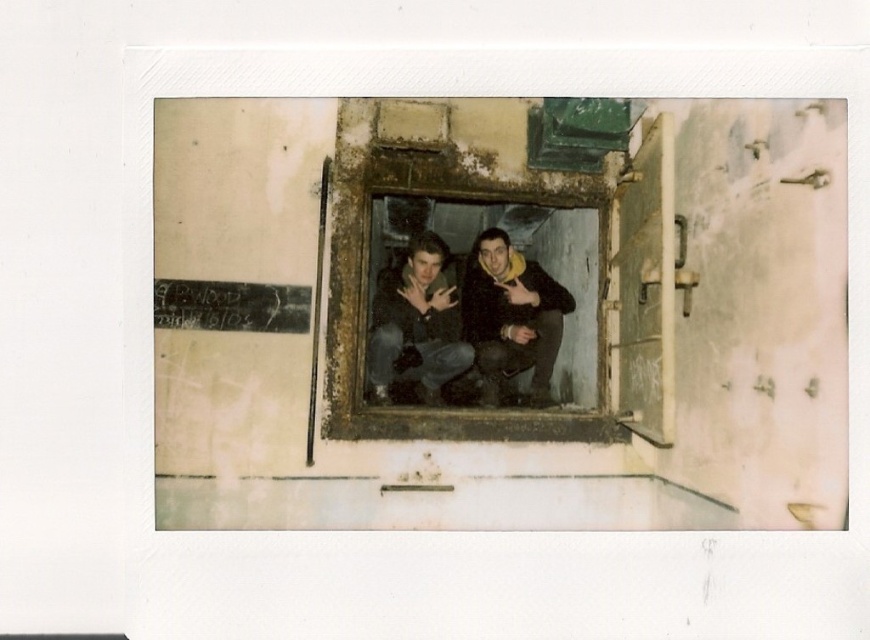
You are a tailor trying to fit a pair of jeans into a narrow washing machine. You have two options in the image, dark blue jeans at center and dark gray jeans at center. Which pair of jeans would you choose to ensure they can fit into the machine?

The dark gray jeans at center are narrower than the dark blue jeans at center, so you should choose the dark gray jeans at center to fit into the narrow washing machine.

You are a tailor measuring the height of two pairs of jeans displayed in a small, worn room. The jeans are placed side by side within a weathered window frame. Which pair of jeans, the dark blue jeans at center or the dark gray jeans at center, has a greater height?

The dark blue jeans at center is taller than the dark gray jeans at center, so the dark blue jeans at center has a greater height.